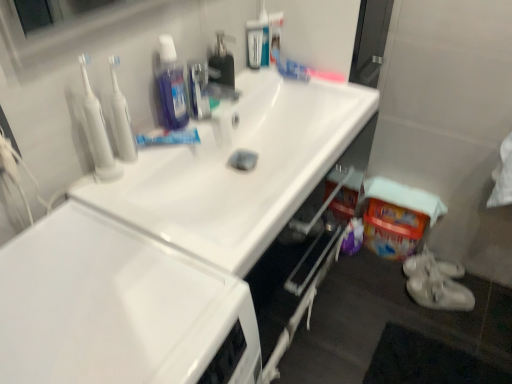
Where is `free space above white fabric towel at lower right (from a real-world perspective)`? Image resolution: width=512 pixels, height=384 pixels. free space above white fabric towel at lower right (from a real-world perspective) is located at coordinates (400, 188).